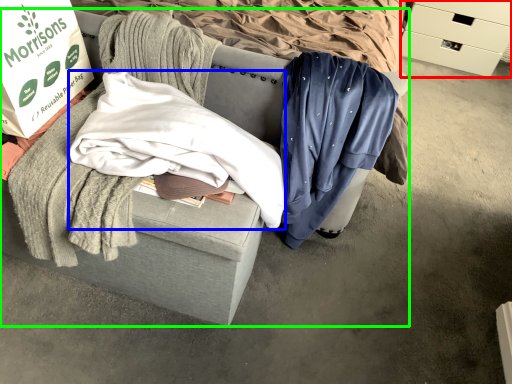
Question: Which object is positioned closest to drawer (highlighted by a red box)? Select from clothing (highlighted by a blue box) and furniture (highlighted by a green box).

Choices:
 (A) clothing
 (B) furniture

Answer: (A)